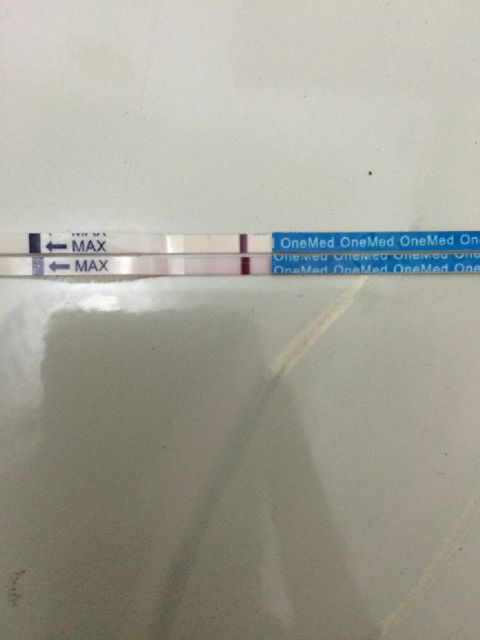
Locate an element on the screen. The image size is (480, 640). table is located at coordinates (321, 577).